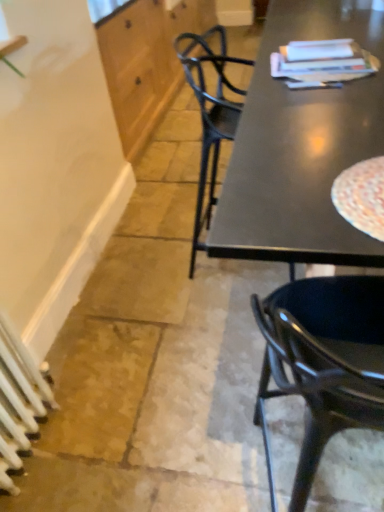
This screenshot has width=384, height=512. Find the location of `glossy black chair at right`. glossy black chair at right is located at coordinates (323, 362).

Which object is wider, white metallic radiator at lower left or glossy black chair at right?

Wider between the two is glossy black chair at right.

Which point is more forward, (6, 446) or (317, 420)?

The point (317, 420) is more forward.

From a real-world perspective, relative to glossy black chair at right, is white metallic radiator at lower left vertically above or below?

From a real-world perspective, white metallic radiator at lower left is physically below glossy black chair at right.

Can you confirm if white metallic radiator at lower left is bigger than glossy black chair at right?

Actually, white metallic radiator at lower left might be smaller than glossy black chair at right.

Is white wood cabinet at upper left smaller than white metallic radiator at lower left?

Actually, white wood cabinet at upper left might be larger than white metallic radiator at lower left.

Can you confirm if white wood cabinet at upper left is taller than white metallic radiator at lower left?

Correct, white wood cabinet at upper left is much taller as white metallic radiator at lower left.

Is white wood cabinet at upper left at the right side of white metallic radiator at lower left?

Yes, white wood cabinet at upper left is to the right of white metallic radiator at lower left.

From a real-world perspective, who is located lower, white wood cabinet at upper left or white metallic radiator at lower left?

In real-world perspective, white metallic radiator at lower left is lower.

Considering the relative sizes of white metallic radiator at lower left and white wood cabinet at upper left in the image provided, is white metallic radiator at lower left wider than white wood cabinet at upper left?

In fact, white metallic radiator at lower left might be narrower than white wood cabinet at upper left.

Could you tell me if white metallic radiator at lower left is turned towards white wood cabinet at upper left?

No, white metallic radiator at lower left is not turned towards white wood cabinet at upper left.

Consider the image. Is white metallic radiator at lower left spatially inside white wood cabinet at upper left, or outside of it?

white metallic radiator at lower left exists outside the volume of white wood cabinet at upper left.

In terms of width, does glossy black chair at right look wider or thinner when compared to white wood cabinet at upper left?

Clearly, glossy black chair at right has less width compared to white wood cabinet at upper left.

Which is nearer, [300,358] or [120,39]?

Clearly, point [300,358] is closer to the camera than point [120,39].

Considering the positions of objects glossy black chair at right and white wood cabinet at upper left in the image provided, who is more to the right, glossy black chair at right or white wood cabinet at upper left?

glossy black chair at right is more to the right.

From the image's perspective, which one is positioned lower, glossy black chair at right or white wood cabinet at upper left?

glossy black chair at right, from the image's perspective.

What are the coordinates of `chair on the right side of white wood cabinet at upper left` in the screenshot? It's located at (323, 362).

Considering their positions, is white wood cabinet at upper left located in front of or behind glossy black chair at right?

Visually, white wood cabinet at upper left is located behind glossy black chair at right.

From a real-world perspective, which is physically above, white wood cabinet at upper left or glossy black chair at right?

In real-world perspective, glossy black chair at right is above.

Between point (141, 32) and point (275, 503), which one is positioned behind?

The point (141, 32) is farther.

Considering the positions of objects glossy black chair at right and white metallic radiator at lower left in the image provided, who is more to the left, glossy black chair at right or white metallic radiator at lower left?

Positioned to the left is white metallic radiator at lower left.

Are glossy black chair at right and white metallic radiator at lower left far apart?

No, glossy black chair at right is not far from white metallic radiator at lower left.

Is white metallic radiator at lower left at the back of glossy black chair at right?

glossy black chair at right is not turned away from white metallic radiator at lower left.

How many degrees apart are the facing directions of glossy black chair at right and white metallic radiator at lower left?

The angular difference between glossy black chair at right and white metallic radiator at lower left is 94.4 degrees.

Identify the location of chair lying on the right of white metallic radiator at lower left. (323, 362).

Where is `cabinetry located above the white metallic radiator at lower left (from a real-world perspective)`? The width and height of the screenshot is (384, 512). cabinetry located above the white metallic radiator at lower left (from a real-world perspective) is located at coordinates (146, 61).

Looking at the image, which one is located closer to glossy black chair at right, white metallic radiator at lower left or white wood cabinet at upper left?

The object closer to glossy black chair at right is white metallic radiator at lower left.

Consider the image. Considering their positions, is white metallic radiator at lower left positioned further to white wood cabinet at upper left than glossy black chair at right?

glossy black chair at right is positioned further to the anchor white wood cabinet at upper left.

Estimate the real-world distances between objects in this image. Which object is further from white wood cabinet at upper left, glossy black chair at right or white metallic radiator at lower left?

Based on the image, glossy black chair at right appears to be further to white wood cabinet at upper left.

Looking at the image, which one is located further to white metallic radiator at lower left, white wood cabinet at upper left or glossy black chair at right?

white wood cabinet at upper left lies further to white metallic radiator at lower left than the other object.

Considering their positions, is glossy black chair at right positioned further to white metallic radiator at lower left than white wood cabinet at upper left?

Result: Among the two, white wood cabinet at upper left is located further to white metallic radiator at lower left.

From the image, which object appears to be nearer to glossy black chair at right, white wood cabinet at upper left or white metallic radiator at lower left?

Based on the image, white metallic radiator at lower left appears to be nearer to glossy black chair at right.

I want to click on chair that lies between white wood cabinet at upper left and white metallic radiator at lower left from top to bottom, so click(323, 362).